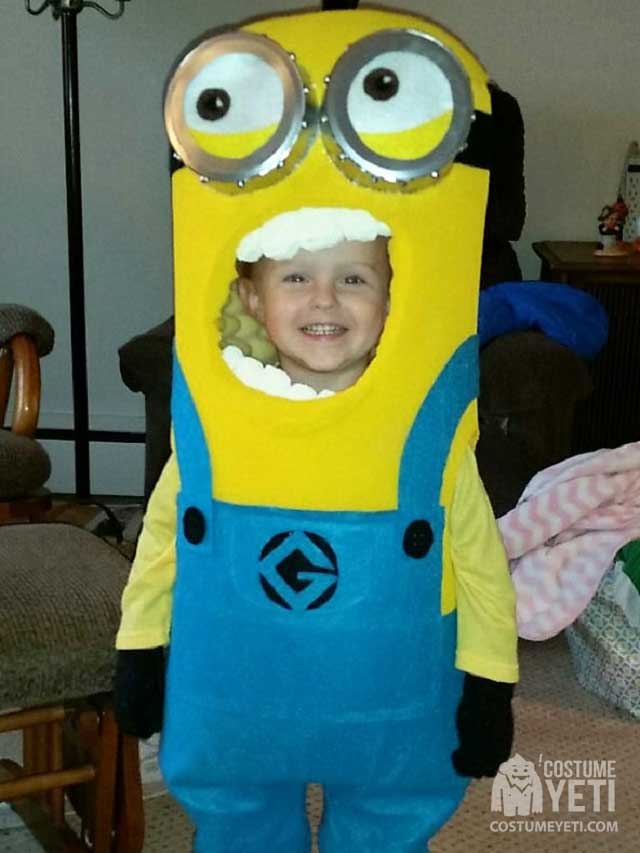
The width and height of the screenshot is (640, 853). I want to click on wooden base to chair armrest, so click(x=27, y=380).